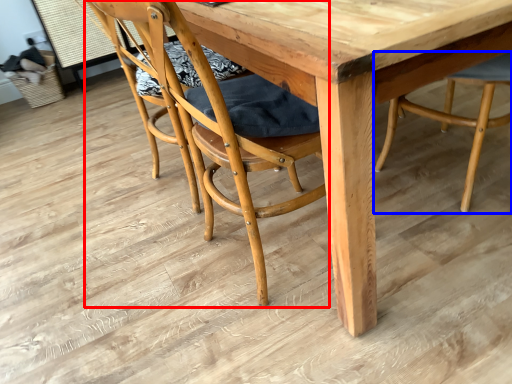
Question: Which object is closer to the camera taking this photo, chair (highlighted by a red box) or chair (highlighted by a blue box)?

Choices:
 (A) chair
 (B) chair

Answer: (A)